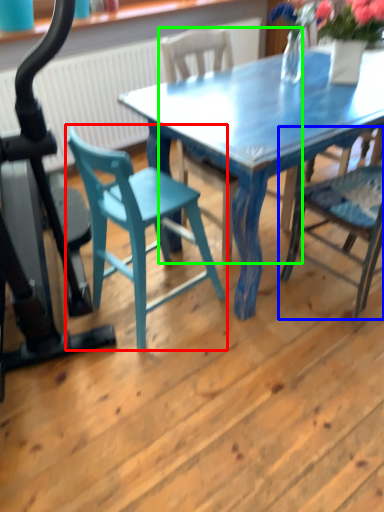
Question: Which object is the farthest from chair (highlighted by a red box)? Choose among these: chair (highlighted by a blue box) or chair (highlighted by a green box).

Choices:
 (A) chair
 (B) chair

Answer: (B)